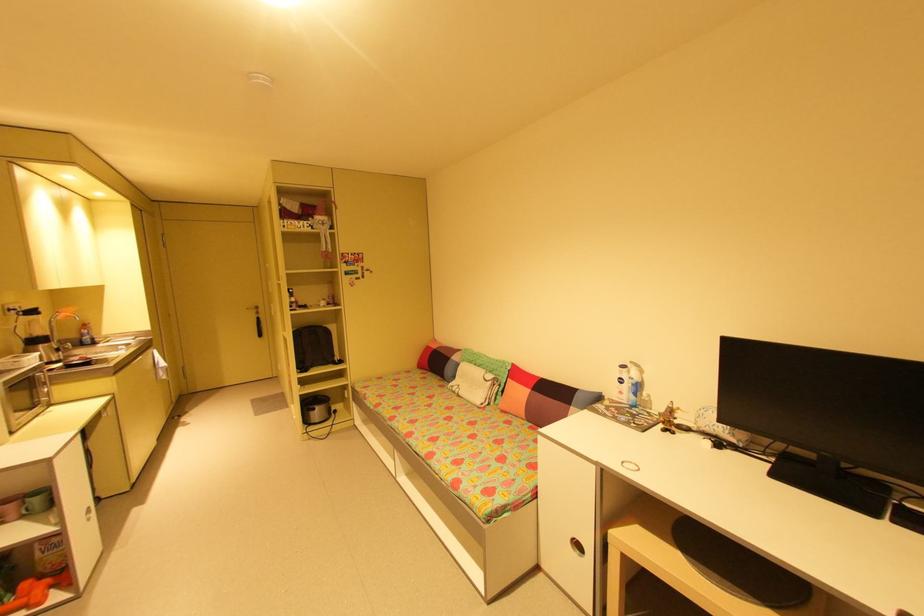
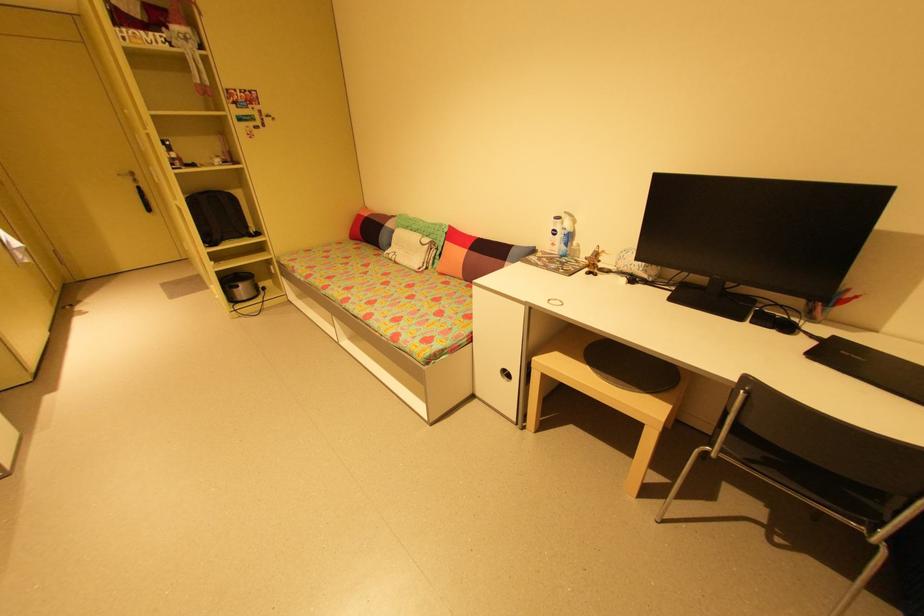
The point at (499, 378) is marked in the first image. Where is the corresponding point in the second image?

(435, 241)